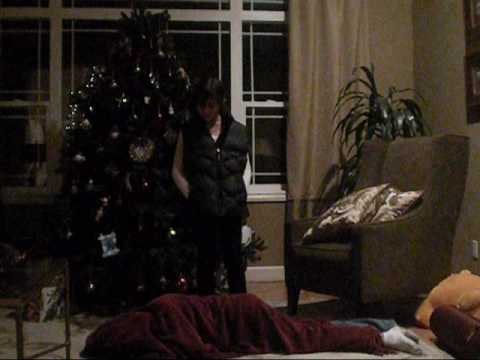
You are a GUI agent. You are given a task and a screenshot of the screen. Output one action in this format:
    pyautogui.click(x=<x>, y=<y>)
    Task: Click on the christmas tree
    Image resolution: width=480 pixels, height=360 pixels.
    Given the screenshot: What is the action you would take?
    click(x=128, y=163)